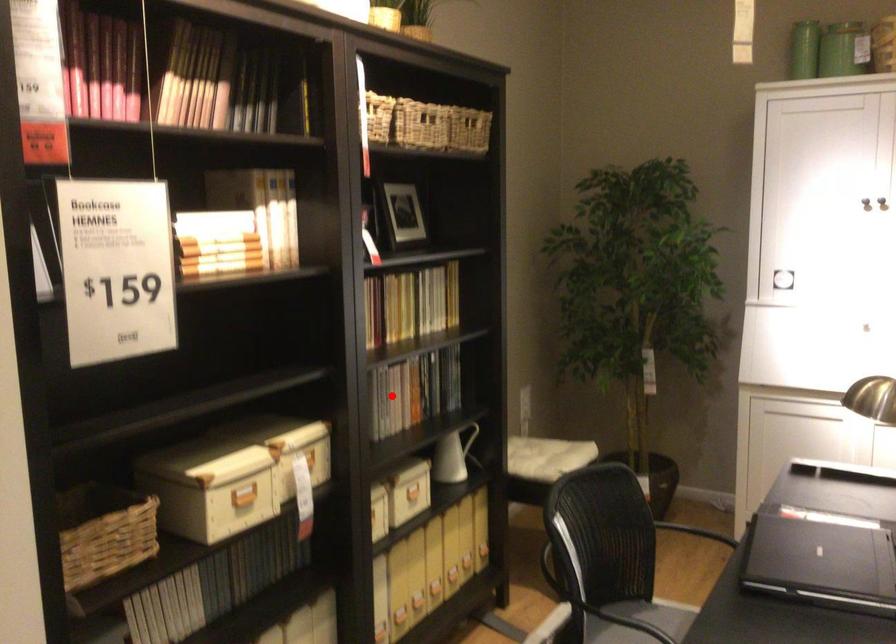
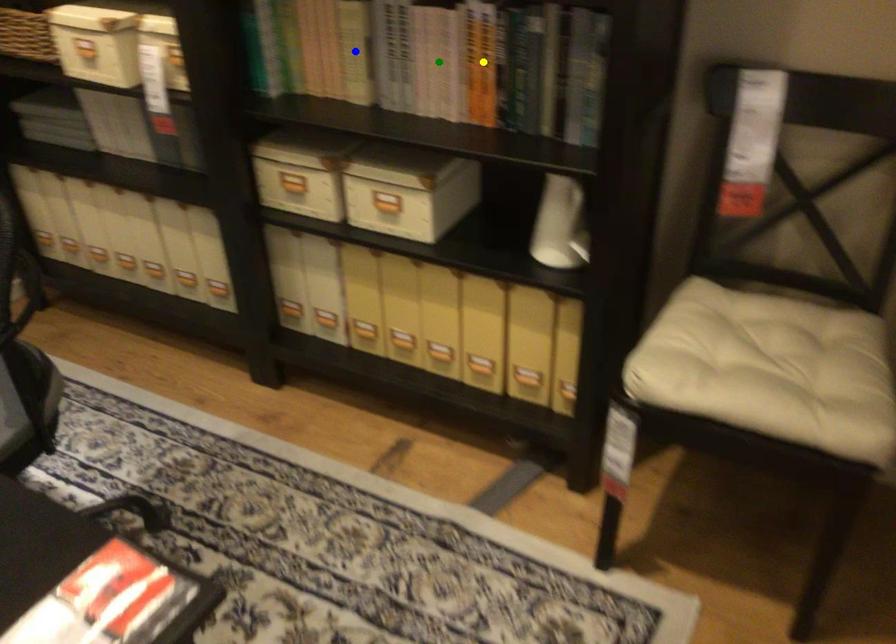
Question: I am providing you with two images of the same scene from different viewpoints. A red point is marked on the first image. You are given multiple points on the second image. In image 2, which mark is for the same physical point as the one in image 1?

Choices:
 (A) yellow point
 (B) green point
 (C) blue point

Answer: (A)